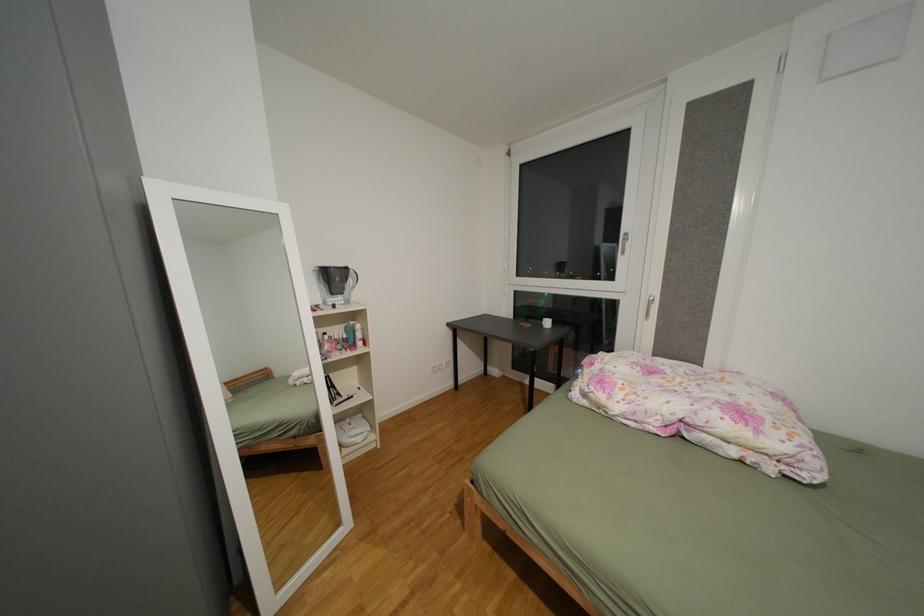
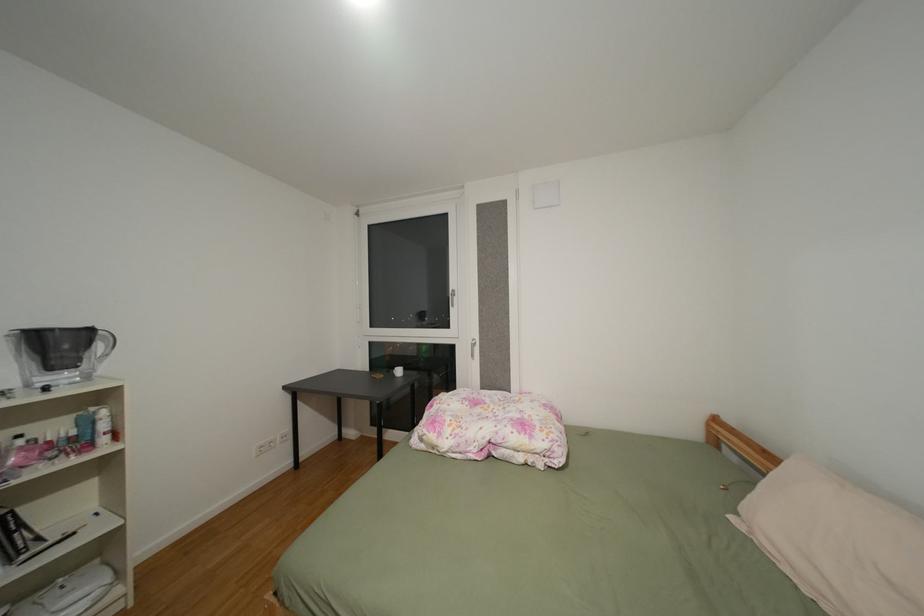
The images are taken continuously from a first-person perspective. In which direction are you moving?

The cameraman walked toward right, backward.